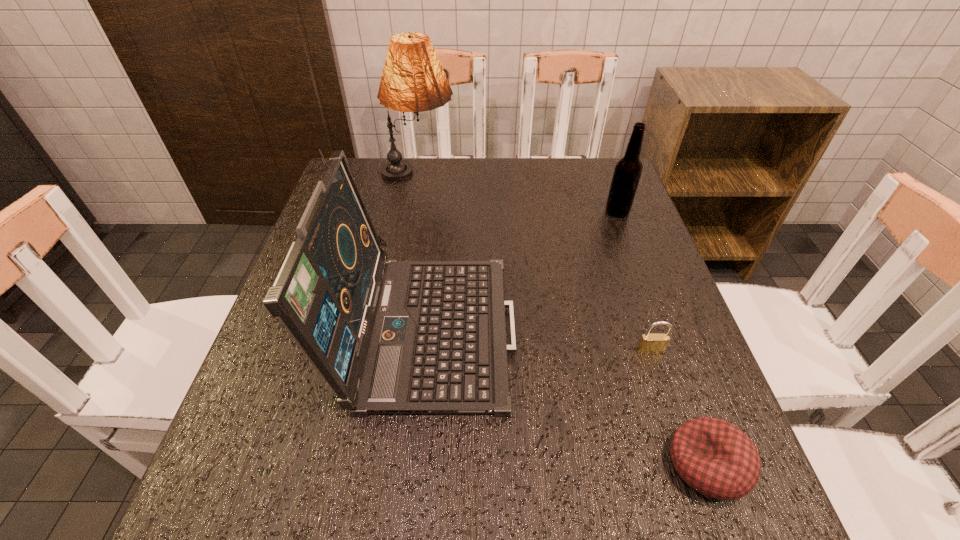
You are a GUI agent. You are given a task and a screenshot of the screen. Output one action in this format:
    pyautogui.click(x=<x>, y=<y>)
    Task: Click on the tallest object
    Image resolution: width=960 pixels, height=540 pixels.
    Given the screenshot: What is the action you would take?
    pyautogui.click(x=413, y=80)

Find the location of a particular element. lampshade is located at coordinates (413, 80).

You are a GUI agent. You are given a task and a screenshot of the screen. Output one action in this format:
    pyautogui.click(x=<x>, y=<y>)
    Task: Click on the laptop computer
    
    Given the screenshot: What is the action you would take?
    pyautogui.click(x=390, y=337)

The width and height of the screenshot is (960, 540). Identify the location of beer bottle. (628, 169).

This screenshot has width=960, height=540. Identify the location of the fourth nearest object. click(628, 169).

You are a GUI agent. You are given a task and a screenshot of the screen. Output one action in this format:
    pyautogui.click(x=<x>, y=<y>)
    Task: Click on the padlock
    The width and height of the screenshot is (960, 540).
    Given the screenshot: What is the action you would take?
    pyautogui.click(x=649, y=343)

Locate an element on the screen. beanbag is located at coordinates (714, 457).

Find the location of a particular element. the nearest object is located at coordinates (714, 457).

Where is `vacant space located on the front-facing side of the farthest object`? This screenshot has width=960, height=540. vacant space located on the front-facing side of the farthest object is located at coordinates (511, 177).

Identify the location of vacant space located 0.330m on the front-facing side of the laptop computer. (673, 323).